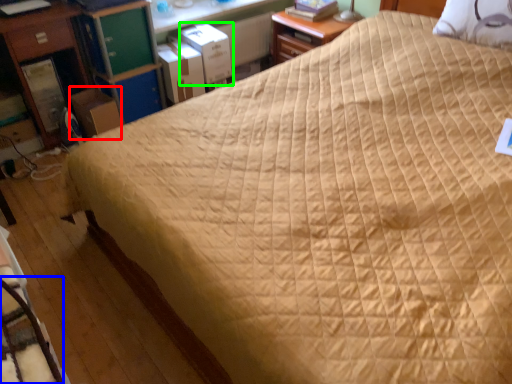
Question: Based on their relative distances, which object is nearer to cardboard box (highlighted by a red box)? Choose from rocking chair (highlighted by a blue box) and cardboard box (highlighted by a green box).

Choices:
 (A) rocking chair
 (B) cardboard box

Answer: (B)